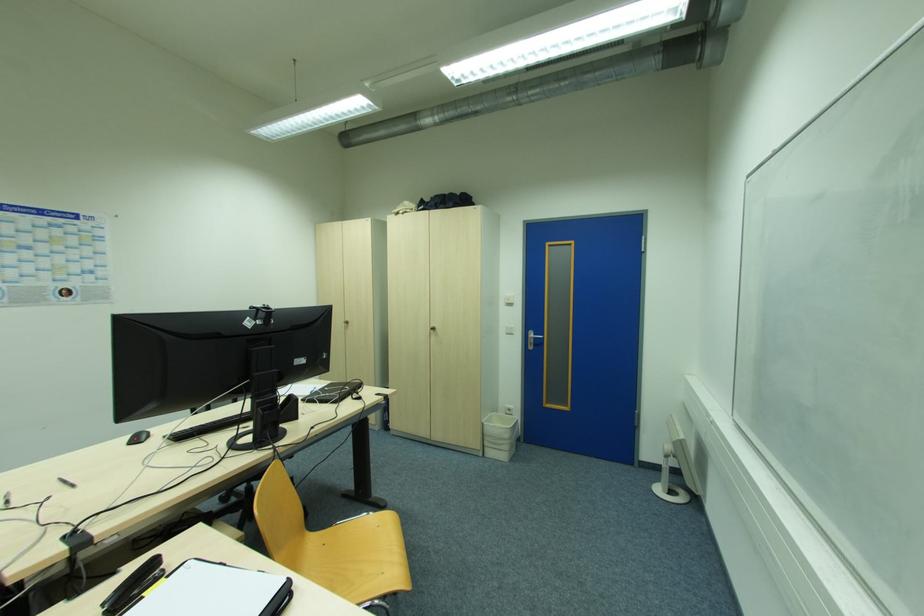
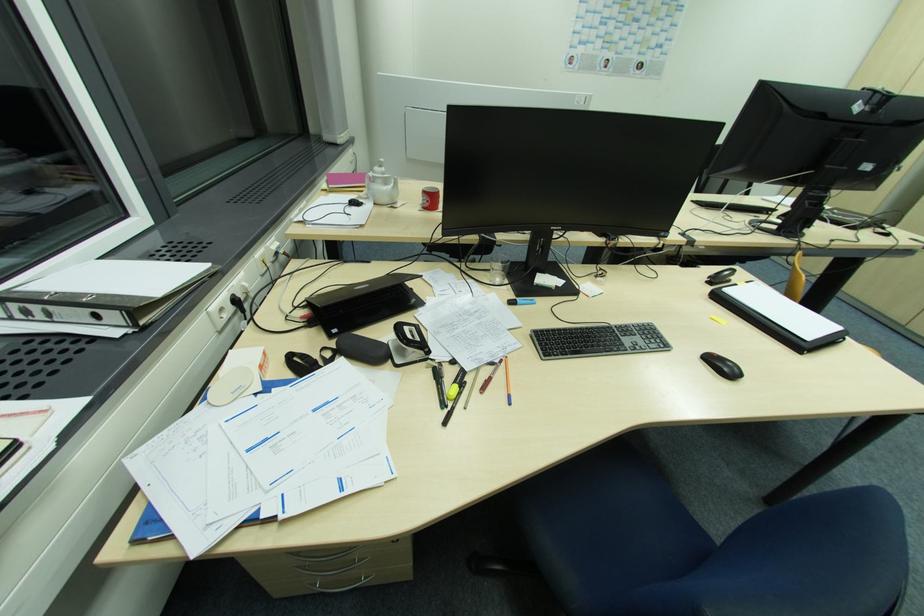
Consider the image. Based on the continuous images, in which direction is the camera rotating?

The camera's rotation is toward left-down.